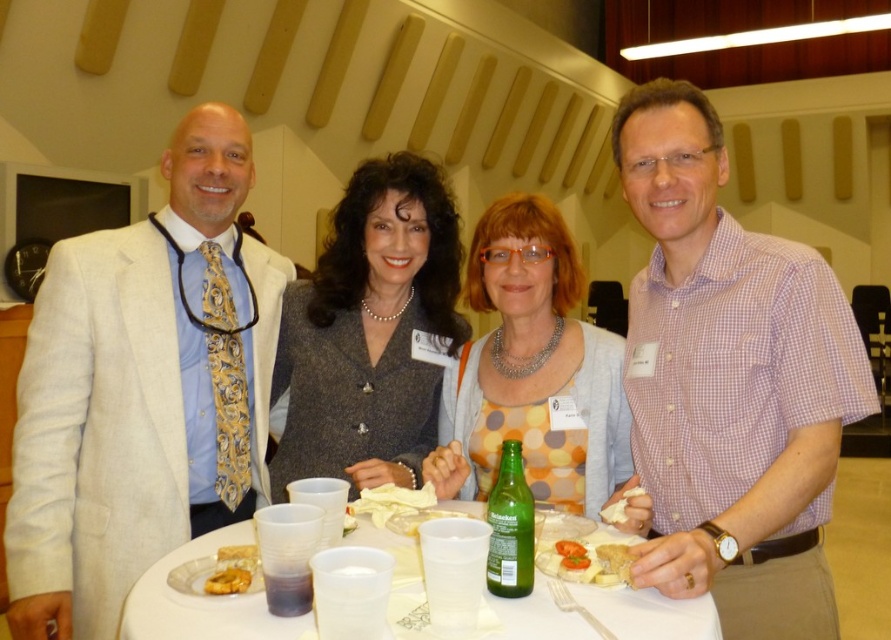
Question: Which point is farther from the camera taking this photo?

Choices:
 (A) (609, 561)
 (B) (231, 577)

Answer: (A)

Question: Is polka dot fabric dress at center to the right of golden crispy pastry at center from the viewer's perspective?

Choices:
 (A) yes
 (B) no

Answer: (A)

Question: Which point is closer to the camera taking this photo?

Choices:
 (A) (631, 556)
 (B) (48, 552)

Answer: (A)

Question: Is white plastic table at center wider than golden crumbly pastry at center?

Choices:
 (A) yes
 (B) no

Answer: (A)

Question: Estimate the real-world distances between objects in this image. Which object is farther from the green glass bottle at center?

Choices:
 (A) golden crumbly pastry at center
 (B) polka dot fabric dress at center

Answer: (B)

Question: Is golden brown bread at center closer to the viewer compared to golden crumbly pastry at center?

Choices:
 (A) yes
 (B) no

Answer: (A)